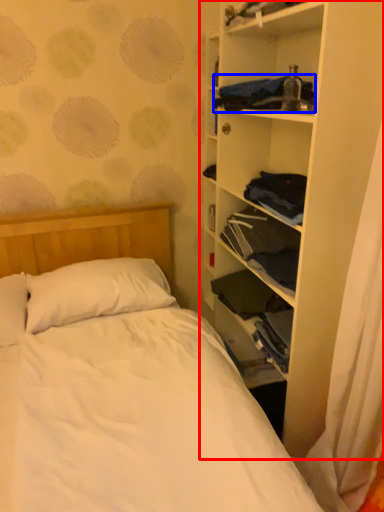
Question: Among these objects, which one is nearest to the camera, shelf (highlighted by a red box) or clothing (highlighted by a blue box)?

Choices:
 (A) shelf
 (B) clothing

Answer: (A)